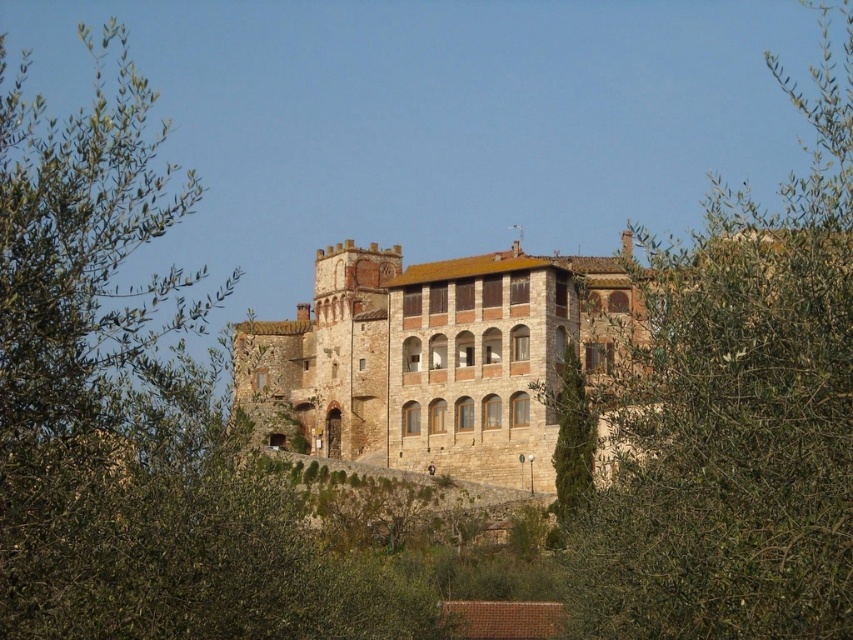
Looking at this image, you are a visitor standing in front of the stone building and want to take a photo that includes both the green leafy tree at center and the green textured tree at lower right. Which tree should you adjust your camera angle to focus on first to ensure both are in the frame?

The green leafy tree at center is located above the green textured tree at lower right, so you should focus on the green leafy tree at center first to ensure both are visible in the frame.

You are standing in front of the stone building and want to take a photo that includes both the green leafy tree at upper left and the green textured tree at lower right. Which tree should you move to your left to include in the frame?

To include both the green leafy tree at upper left and the green textured tree at lower right in the frame, you should move to the left side of the green textured tree at lower right since the green leafy tree at upper left is positioned on the left side of it.